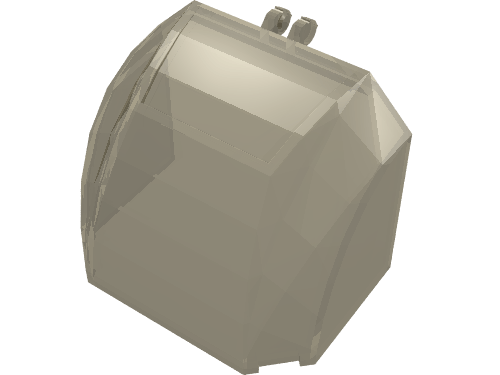
Find the location of a particular element. left corner is located at coordinates (388, 269).